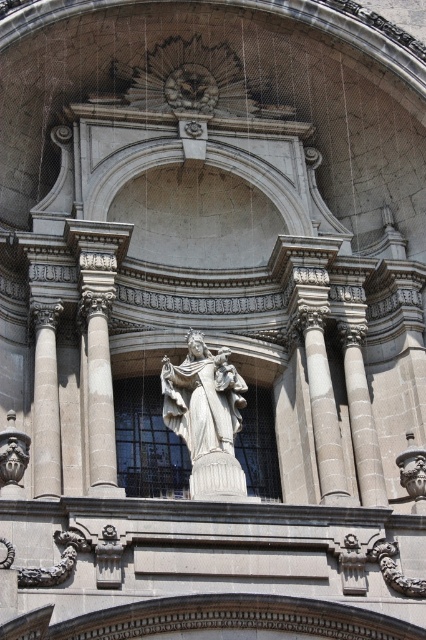
Question: Among these objects, which one is nearest to the camera?

Choices:
 (A) white marble statue at center
 (B) gray stone column at center

Answer: (B)

Question: Which of the following is the closest to the observer?

Choices:
 (A) gray stone column at center
 (B) white marble column at left
 (C) white marble statue at center

Answer: (A)

Question: Where is gray stone column at center located in relation to white marble column at left in the image?

Choices:
 (A) above
 (B) below

Answer: (A)

Question: Considering the relative positions of white marble statue at center and white marble column at left in the image provided, where is white marble statue at center located with respect to white marble column at left?

Choices:
 (A) above
 (B) below

Answer: (B)

Question: In this image, where is white marble statue at center located relative to gray stone column at center?

Choices:
 (A) below
 (B) above

Answer: (A)

Question: Estimate the real-world distances between objects in this image. Which object is closer to the white marble statue at center?

Choices:
 (A) white marble column at left
 (B) gray stone column at center

Answer: (B)